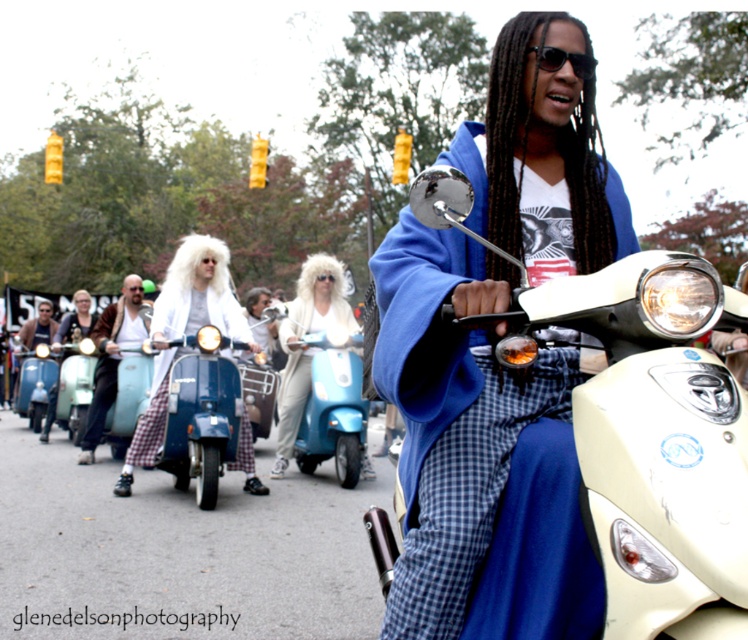
You are a photographer trying to capture a clear shot of the blue fleece jacket at center and blue matte scooter at center. Since you want the jacket to appear to the right of the scooter in your photo, does the current arrangement allow this?

Yes, the blue fleece jacket at center is already positioned to the right of the blue matte scooter at center, so the current arrangement allows the jacket to appear to the right of the scooter in the photo.

You are a photographer trying to capture a clear shot of the brown leather jacket at center and the blue matte scooter at center. Which object should you focus on first if you want to ensure both are in focus without adjusting your camera settings?

The brown leather jacket at center is below the blue matte scooter at center, so you should focus on the blue matte scooter at center first since it is closer to the camera. This will ensure both objects are in focus as the jacket is behind it.

You are standing at the center of the image. There is a point marked at (111, 355). What object is located at that point?

The brown leather jacket at center is located at point (111, 355).